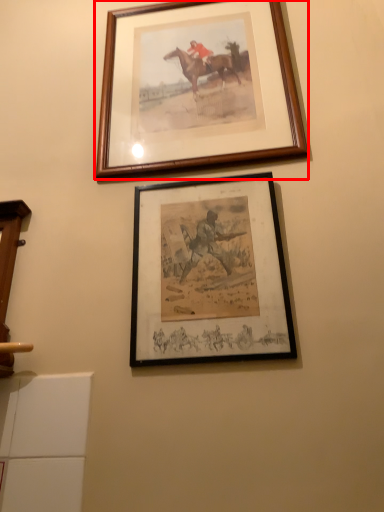
Question: Observing the image, what is the correct spatial positioning of picture frame (annotated by the red box) in reference to picture frame?

Choices:
 (A) right
 (B) left

Answer: (B)